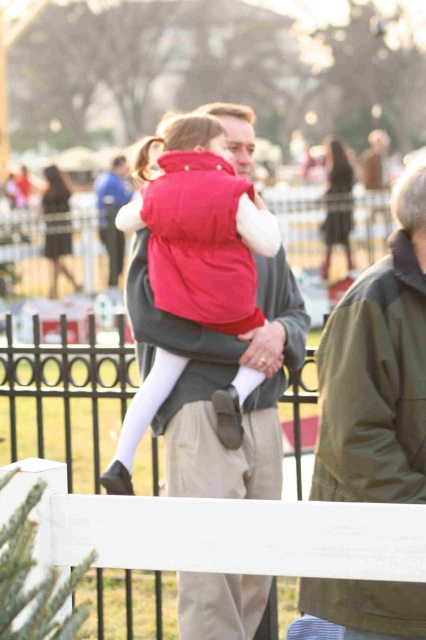
Question: Considering the relative positions of khaki fabric jacket at right and matte black dress at center in the image provided, where is khaki fabric jacket at right located with respect to matte black dress at center?

Choices:
 (A) left
 (B) right

Answer: (A)

Question: Which of the following is the closest to the observer?

Choices:
 (A) matte black dress at center
 (B) khaki fabric jacket at right
 (C) black dress at center
 (D) matte red vest at center

Answer: (B)

Question: Considering the relative positions of khaki fabric jacket at right and matte red vest at center in the image provided, where is khaki fabric jacket at right located with respect to matte red vest at center?

Choices:
 (A) below
 (B) above

Answer: (A)

Question: Which of these objects is positioned closest to the matte red vest at center?

Choices:
 (A) matte black dress at center
 (B) khaki fabric jacket at right

Answer: (B)

Question: Which of the following is the closest to the observer?

Choices:
 (A) (348, 296)
 (B) (68, 243)
 (C) (175, 368)
 (D) (342, 188)

Answer: (A)

Question: Can you confirm if matte red vest at center is wider than black dress at center?

Choices:
 (A) no
 (B) yes

Answer: (B)